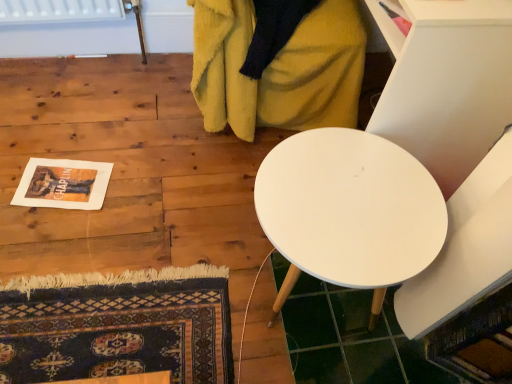
Find the location of a particular element. free space to the left of soft yellow blanket at upper center is located at coordinates (118, 115).